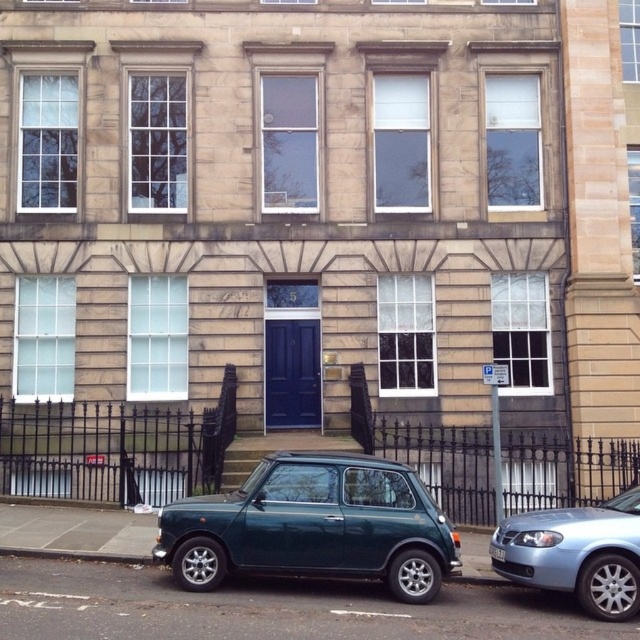
You are a delivery driver needing to park your teal glossy hatchback at lower center and light blue metallic sedan at lower right in a narrow alley that can only accommodate vehicles up to 1.8 meters in width. Which vehicle should you park first to ensure both can fit?

The teal glossy hatchback at lower center is wider than the light blue metallic sedan at lower right. Since the alley can only accommodate vehicles up to 1.8 meters, you should park the light blue metallic sedan at lower right first, ensuring both vehicles are within the width limit. However, if the hatchback exceeds 1.8 meters, it cannot be parked at all.

You are a delivery person who needs to park your vehicle in front of the two story building. The teal glossy hatchback at lower center and the light blue metallic sedan at lower right are already parked there. Which vehicle takes up more space in the parking area?

The teal glossy hatchback at lower center takes up more space in the parking area because it has a larger size compared to the light blue metallic sedan at lower right.

You are standing in front of the two story building and want to determine the relative positions of two points marked on the facade. Which point is closer to you, point (621, 568) or point (497, 552)?

Point (621, 568) is closer to the viewer than point (497, 552).